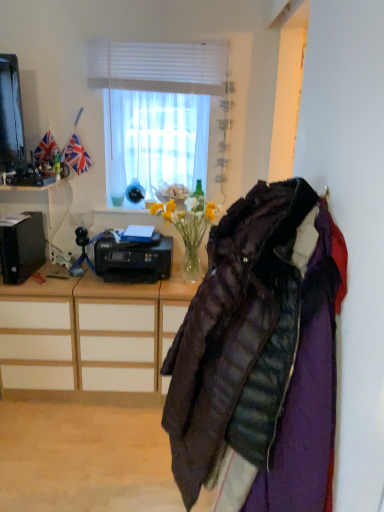
What are the coordinates of `free space above white matte window at upper center (from a real-world perspective)` in the screenshot? It's located at (162, 34).